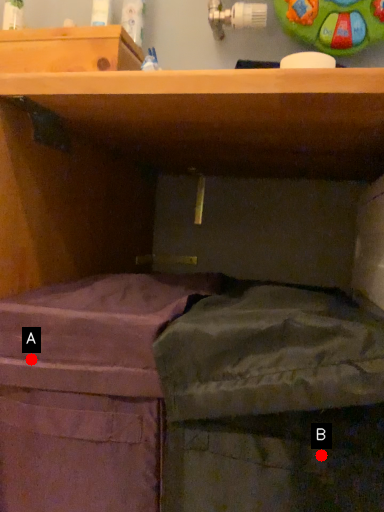
Question: Two points are circled on the image, labeled by A and B beside each circle. Among these points, which one is nearest to the camera?

Choices:
 (A) A is closer
 (B) B is closer

Answer: (B)